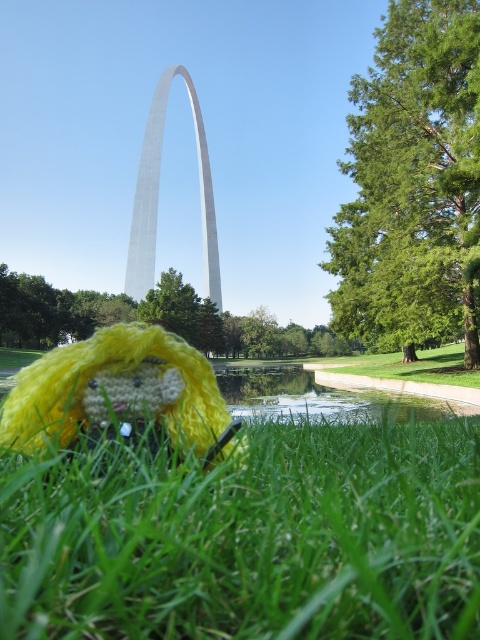
How distant is yellow yarn toy at lower left from silver metallic gateway arch at center?

They are 476.90 feet apart.

Looking at this image, who is more forward, (108, 330) or (133, 260)?

Positioned in front is point (108, 330).

Identify the location of yellow yarn toy at lower left. (120, 394).

Is green fuzzy grass at lower left positioned in front of yellow yarn toy at lower left?

Yes, green fuzzy grass at lower left is closer to the viewer.

Which is behind, point (218, 579) or point (163, 380)?

Point (163, 380)

Image resolution: width=480 pixels, height=640 pixels. In order to click on green fuzzy grass at lower left in this screenshot , I will do `click(252, 528)`.

You are a GUI agent. You are given a task and a screenshot of the screen. Output one action in this format:
    pyautogui.click(x=<x>, y=<y>)
    Task: Click on the green fuzzy grass at lower left
    The width and height of the screenshot is (480, 640).
    Given the screenshot: What is the action you would take?
    pyautogui.click(x=252, y=528)

Does green fuzzy grass at lower left have a lesser height compared to silver metallic gateway arch at center?

Yes.

Who is more distant from viewer, (434, 582) or (140, 211)?

Positioned behind is point (140, 211).

In order to click on green fuzzy grass at lower left in this screenshot , I will do `click(252, 528)`.